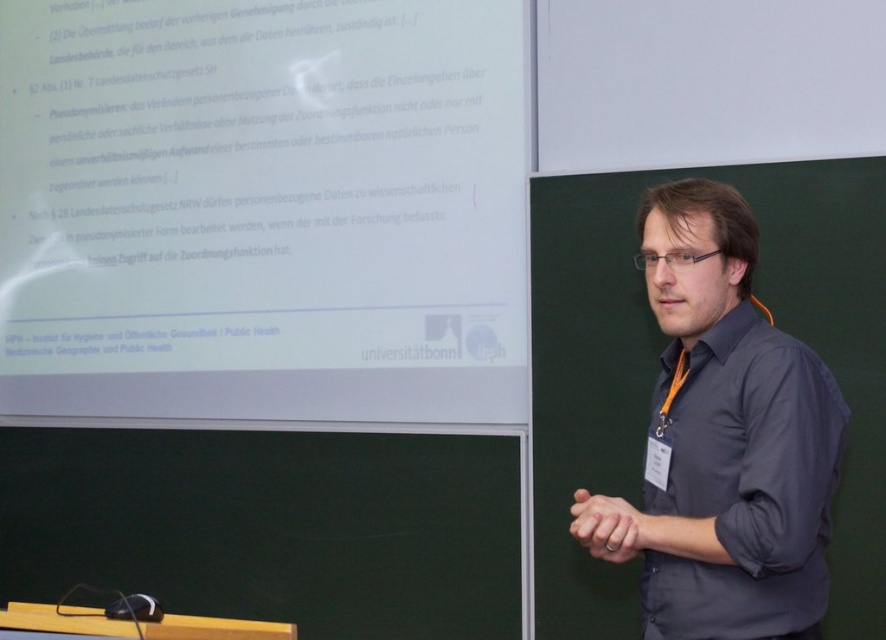
Between point (387, 278) and point (680, 413), which one is positioned in front?

Point (680, 413)

Does white paper at upper center have a greater height compared to dark gray shirt at center?

Correct, white paper at upper center is much taller as dark gray shirt at center.

Describe the element at coordinates (263, 209) in the screenshot. I see `white paper at upper center` at that location.

Locate an element on the screen. The width and height of the screenshot is (886, 640). white paper at upper center is located at coordinates (263, 209).